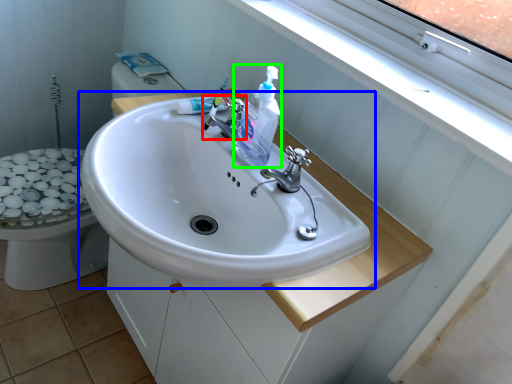
Question: Which is nearer to the tap (highlighted by a red box)? sink (highlighted by a blue box) or cleaning product (highlighted by a green box).

Choices:
 (A) sink
 (B) cleaning product

Answer: (B)